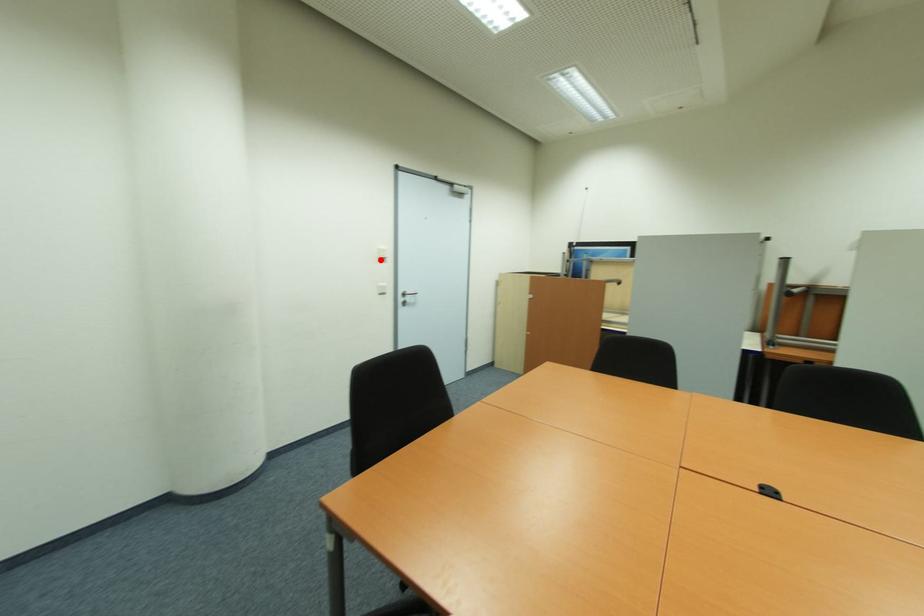
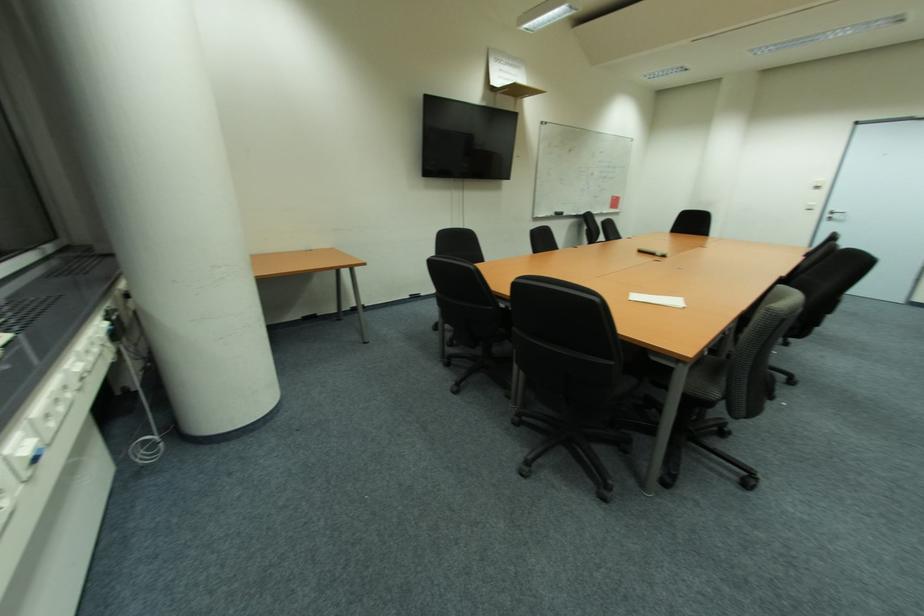
Question: I am providing you with two images of the same scene from different viewpoints. A red point is marked on the first image. Is the red point's position out of view in image 2?

Choices:
 (A) Yes
 (B) No

Answer: (B)